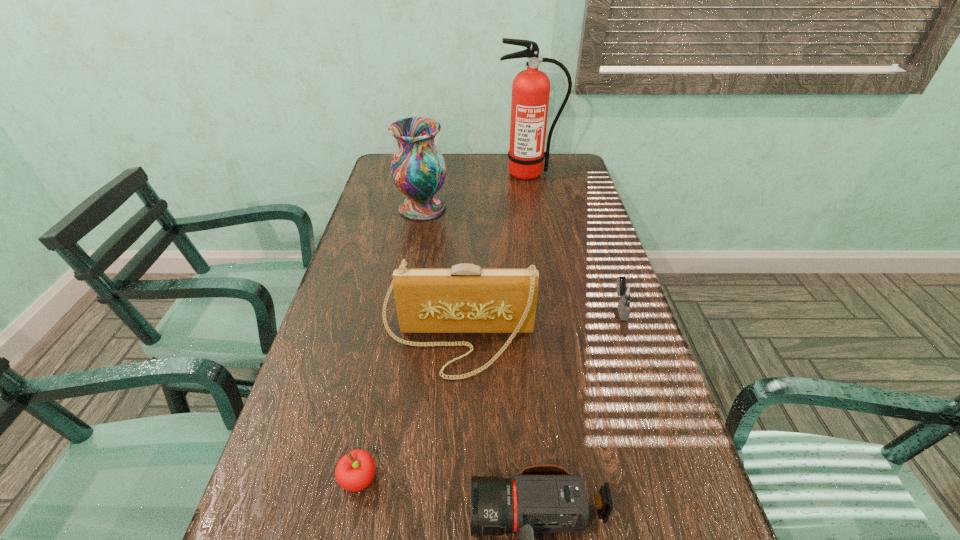
Locate an element on the screen. This screenshot has height=540, width=960. vacant region at the left edge is located at coordinates (346, 330).

Where is `free space at the right edge`? free space at the right edge is located at coordinates pyautogui.click(x=604, y=329).

What are the coordinates of `free space between the handbag and the fire extinguisher` in the screenshot? It's located at (493, 259).

Where is `unoccupied position between the apple and the fourth shortest object`? unoccupied position between the apple and the fourth shortest object is located at coordinates (408, 411).

Where is `free spot between the igniter and the vase`? free spot between the igniter and the vase is located at coordinates (521, 258).

This screenshot has width=960, height=540. I want to click on empty space between the tallest object and the igniter, so click(x=574, y=240).

Find the location of a particular element. The height and width of the screenshot is (540, 960). vacant space that's between the apple and the fourth shortest object is located at coordinates (408, 411).

Image resolution: width=960 pixels, height=540 pixels. Identify the location of object that stands as the fourth closest to the third tallest object. (418, 169).

Identify the location of object that is the fourth closest one to the camcorder. (418, 169).

This screenshot has width=960, height=540. What are the coordinates of `vacant space that satisfies the following two spatial constraints: 1. on the handle side of the fire extinguisher; 2. on the left side of the rightmost object` in the screenshot? It's located at (552, 308).